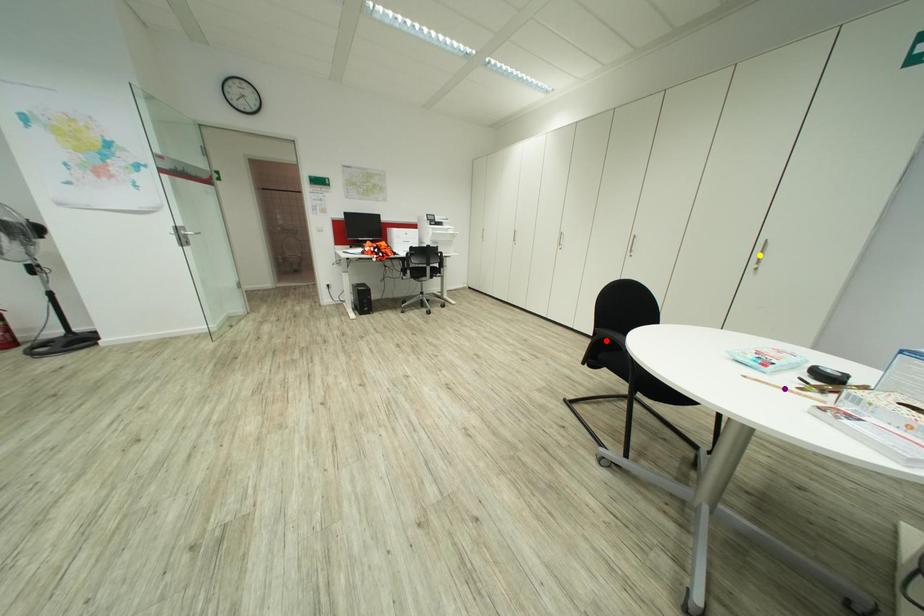
Order these from nearest to farthest:
yellow point, red point, purple point

purple point < yellow point < red point